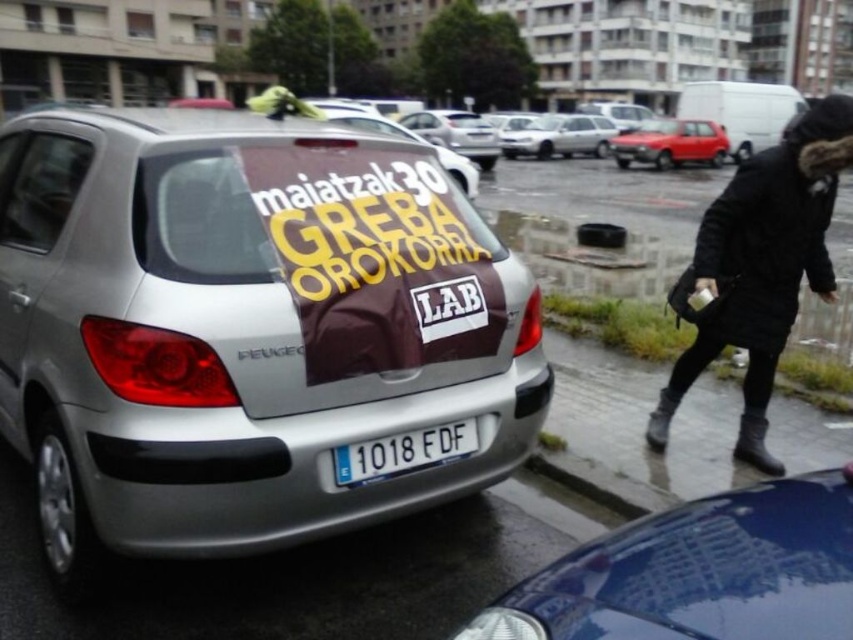
Who is positioned more to the right, shiny blue car at lower right or silver metallic sedan at center?

Positioned to the right is silver metallic sedan at center.

Is the position of shiny blue car at lower right less distant than that of silver metallic sedan at center?

Yes.

Which is behind, point (822, 468) or point (599, 134)?

Point (599, 134)

Identify the location of shiny blue car at lower right. (699, 572).

Who is taller, shiny red car at center or silver metallic sedan at center?

shiny red car at center

Does point (672, 131) come closer to viewer compared to point (572, 131)?

Yes, point (672, 131) is in front of point (572, 131).

You are a GUI agent. You are given a task and a screenshot of the screen. Output one action in this format:
    pyautogui.click(x=<x>, y=<y>)
    Task: Click on the shiny red car at center
    This screenshot has height=640, width=853.
    Given the screenshot: What is the action you would take?
    pyautogui.click(x=671, y=144)

Can you confirm if shiny blue car at lower right is shorter than white plastic license plate at center?

No.

Is the position of shiny blue car at lower right less distant than that of white plastic license plate at center?

Yes, shiny blue car at lower right is in front of white plastic license plate at center.

Identify the location of shiny blue car at lower right. Image resolution: width=853 pixels, height=640 pixels. (699, 572).

At what (x,y) coordinates should I click in order to perform the action: click on shiny blue car at lower right. Please return your answer as a coordinate pair (x, y). Image resolution: width=853 pixels, height=640 pixels. Looking at the image, I should click on tap(699, 572).